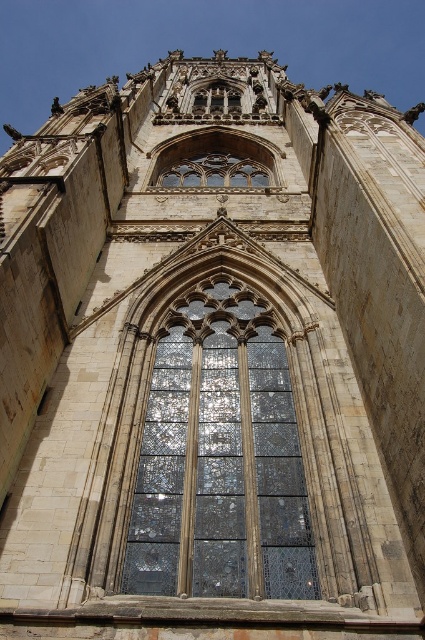
Question: Among these points, which one is nearest to the camera?

Choices:
 (A) (218, 371)
 (B) (223, 184)

Answer: (A)

Question: Is stained glass window at center to the right of stained glass window at upper center from the viewer's perspective?

Choices:
 (A) no
 (B) yes

Answer: (B)

Question: Which point is farther to the camera?

Choices:
 (A) stained glass window at center
 (B) stained glass window at upper center

Answer: (B)

Question: Is stained glass window at center above stained glass window at upper center?

Choices:
 (A) yes
 (B) no

Answer: (B)

Question: Is stained glass window at center above stained glass window at upper center?

Choices:
 (A) no
 (B) yes

Answer: (A)